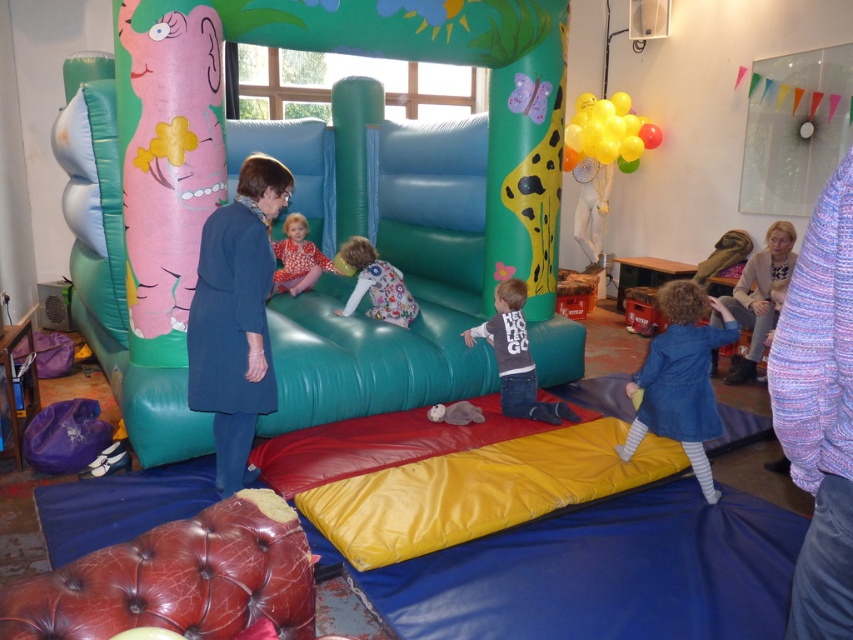
You are standing at the entrance of the play area and want to reach the point marked as point (x=708, y=392). However, there is an obstacle at point (x=781, y=278). Will you be able to walk directly to your destination without going around the obstacle?

Point (x=708, y=392) is in front of point (x=781, y=278). This means the destination is closer to you than the obstacle, so you can walk directly to point (x=708, y=392) without needing to go around the obstacle.

You are a parent standing in the play area and want to ensure your child, wearing dark gray denim jeans at center, can safely reach the green inflatable slide at center. Given that the safety guideline states a minimum distance of 1 meter between play equipment and children, is the current distance compliant?

The distance between the green inflatable slide at center and dark gray denim jeans at center is 1.12 meters, which exceeds the required 1 meter safety guideline. Therefore, the current distance is compliant with safety standards.